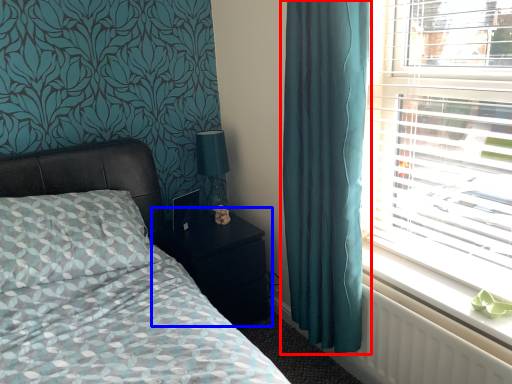
Question: Which of the following is the closest to the observer, curtain (highlighted by a red box) or nightstand (highlighted by a blue box)?

Choices:
 (A) curtain
 (B) nightstand

Answer: (A)